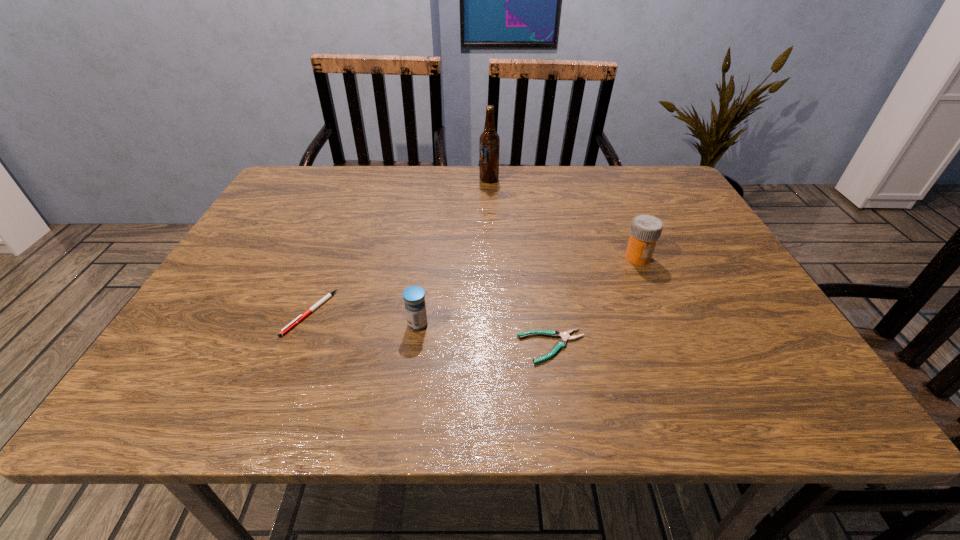
Where is `vacant point located 0.220m on the label of the third object from left to right`? Image resolution: width=960 pixels, height=540 pixels. vacant point located 0.220m on the label of the third object from left to right is located at coordinates (405, 180).

Identify the location of free space located 0.190m on the label of the third object from left to right. click(x=416, y=180).

At what (x,y) coordinates should I click in order to perform the action: click on vacant area located on the label of the third object from left to right. Please return your answer as a coordinate pair (x, y). The image size is (960, 540). Looking at the image, I should click on (425, 180).

At what (x,y) coordinates should I click in order to perform the action: click on vacant space situated on the label side of the right medicine. Please return your answer as a coordinate pair (x, y). Looking at the image, I should click on (672, 335).

The height and width of the screenshot is (540, 960). I want to click on free space located 0.260m on the left of the second object from left to right, so click(276, 325).

Find the location of `free point located on the clicker of the leftmost object`. free point located on the clicker of the leftmost object is located at coordinates (278, 392).

Find the location of a particular element. The height and width of the screenshot is (540, 960). vacant space situated 0.110m on the right of the fourth object from left to right is located at coordinates (644, 347).

The width and height of the screenshot is (960, 540). I want to click on object that is positioned at the far edge, so click(x=489, y=139).

In the image, there is a desktop. Find the location of `vacant space at the far edge`. vacant space at the far edge is located at coordinates (367, 172).

Locate an element on the screen. vacant space at the near edge of the desktop is located at coordinates (308, 401).